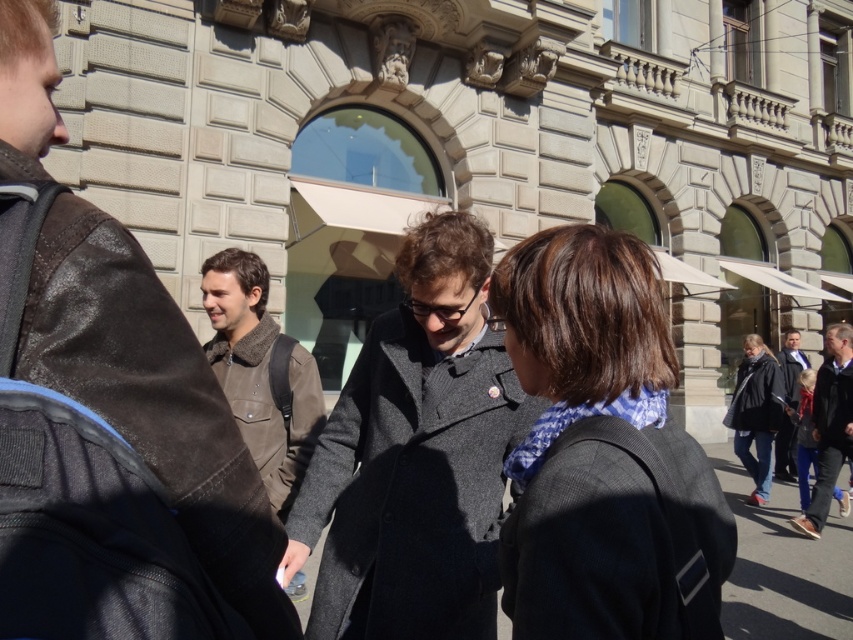
You are a photographer trying to capture both the brown leather jacket at left and the dark gray coat at right in a single frame. Given that your camera can only focus on objects with a width difference of up to 10 cm, can you ensure both will be in focus?

The brown leather jacket at left is wider than the dark gray coat at right. Since the width difference between them is not specified, but the camera can handle up to 10 cm, it is possible they can both be in focus if the difference is within that range. However, without exact measurements, this cannot be confirmed definitively.

You are standing in front of the classical building and notice the brown leather jacket at left. If you want to approach the person wearing it, in which general direction should you move from your current position?

The brown leather jacket at left is located at point 0.620 on the x and 0.179 on the y coordinate. Since the jacket is on the left side of the image, you should move to your left to approach the person wearing it.